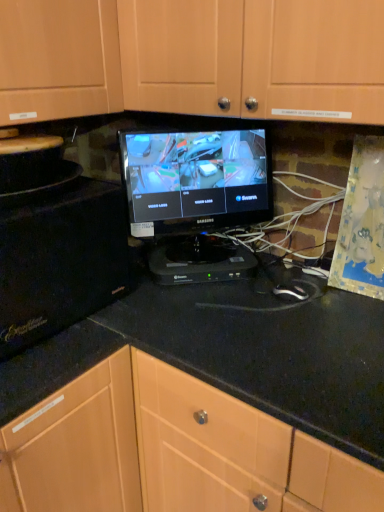
Find the location of a particular element. This screenshot has height=512, width=384. vacant space situated on the left part of black plastic mouse at center is located at coordinates (235, 303).